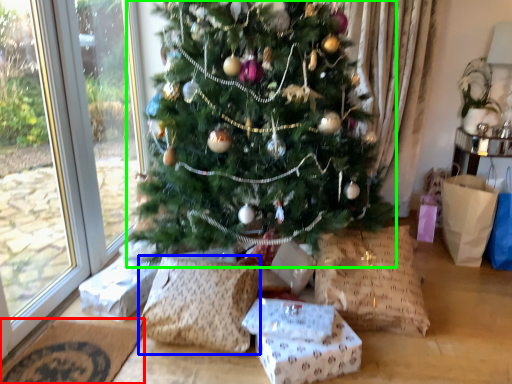
Question: Which object is positioned closest to doormat (highlighted by a red box)? Select from pillow (highlighted by a blue box) and christmas tree (highlighted by a green box).

Choices:
 (A) pillow
 (B) christmas tree

Answer: (A)